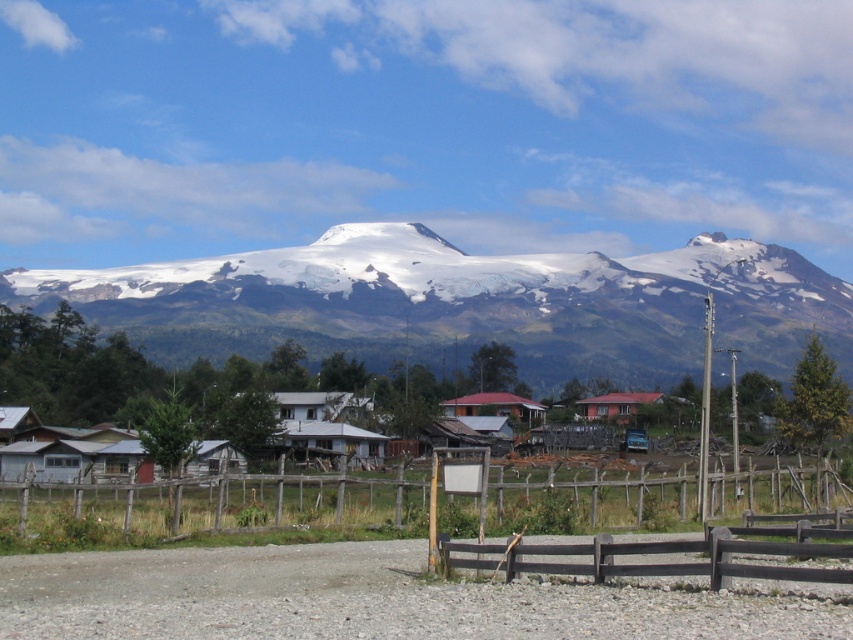
Question: Can you confirm if rustic wooden houses at center is bigger than red corrugated metal hut at center?

Choices:
 (A) no
 (B) yes

Answer: (B)

Question: Which object appears farthest from the camera in this image?

Choices:
 (A) white snow-covered peak at center
 (B) wooden fence at center
 (C) rustic wooden houses at center
 (D) red matte house at center

Answer: (A)

Question: Is snowy rock mountain range at center above rustic wooden houses at center?

Choices:
 (A) yes
 (B) no

Answer: (A)

Question: Is wooden fence at center to the left of rustic wooden houses at center from the viewer's perspective?

Choices:
 (A) yes
 (B) no

Answer: (B)

Question: Which object is the farthest from the brown wooden fence at lower center?

Choices:
 (A) snowy rock mountain range at center
 (B) white snow-covered peak at center
 (C) wooden fence at center
 (D) rustic wooden houses at center

Answer: (B)

Question: Which of the following is the closest to the observer?

Choices:
 (A) red corrugated metal hut at center
 (B) rustic wooden houses at center
 (C) red matte house at center
 (D) wooden fence at center

Answer: (D)